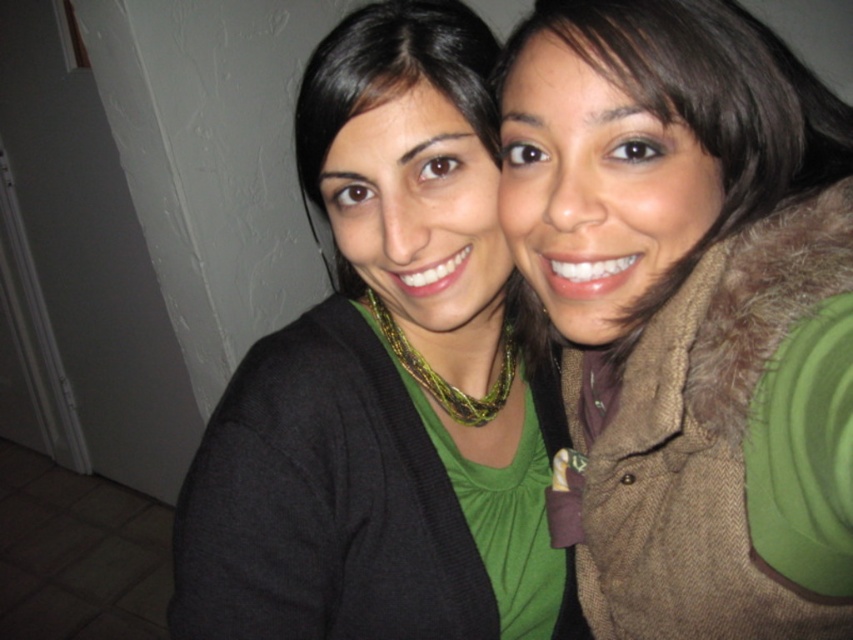
Can you confirm if green fuzzy vest at upper right is shorter than black matte cardigan at center?

Yes, green fuzzy vest at upper right is shorter than black matte cardigan at center.

Who is positioned more to the right, green fuzzy vest at upper right or black matte cardigan at center?

Positioned to the right is green fuzzy vest at upper right.

Where is `green fuzzy vest at upper right`? The width and height of the screenshot is (853, 640). green fuzzy vest at upper right is located at coordinates (689, 312).

The width and height of the screenshot is (853, 640). I want to click on green fuzzy vest at upper right, so click(x=689, y=312).